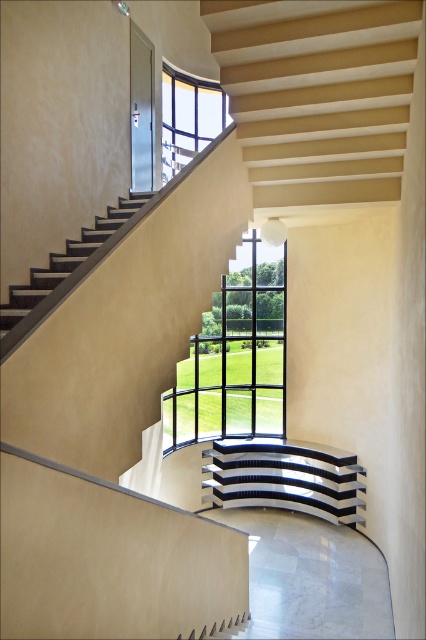
You are standing at the bottom of the staircase and want to reach the clear glass window at upper center. Which direction should you move relative to the polished chrome stair at center?

To reach the clear glass window at upper center, you should move upwards along the polished chrome stair at center since it is located below the window.

You are an interior designer assessing the natural light in this modern staircase area. You notice the black glass window at center and the clear glass window at upper center. Which window allows more natural light into the space?

The clear glass window at upper center allows more natural light into the space since it is made of clear glass, which is more transparent than the black glass window at center.